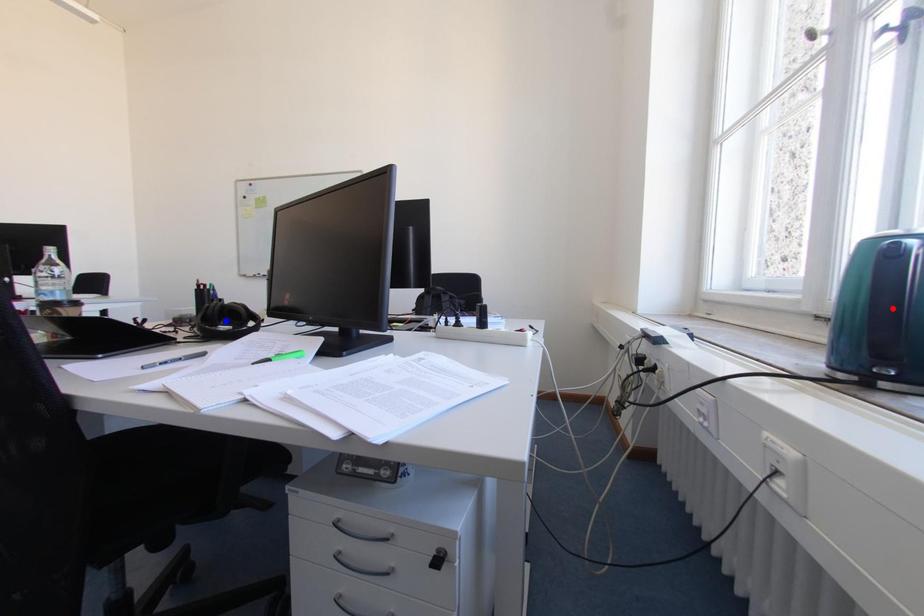
Question: In the image, two points are highlighted. Which point is nearer to the camera? Reply with the corresponding letter.

Choices:
 (A) blue point
 (B) red point

Answer: (B)